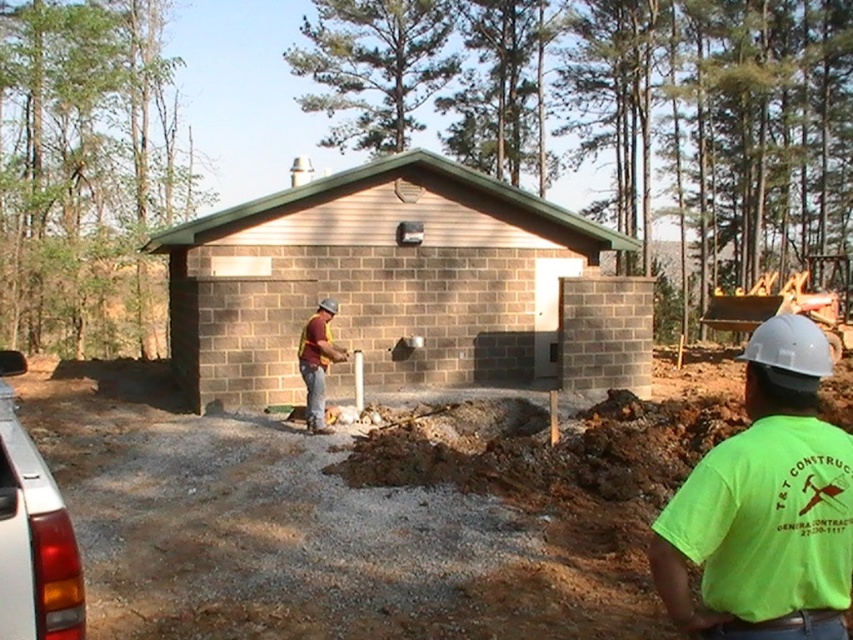
Question: Is brown brick building at center above brown fabric safety vest at center?

Choices:
 (A) yes
 (B) no

Answer: (B)

Question: Which of the following is the farthest from the observer?

Choices:
 (A) neon green t-shirt at center
 (B) brown fabric safety vest at center
 (C) maroon fabric shirt at center

Answer: (B)

Question: Which point is closer to the camera?

Choices:
 (A) (312, 349)
 (B) (343, 211)
 (C) (318, 417)
 (D) (840, 541)

Answer: (D)

Question: Is brown brick building at center positioned before neon green t-shirt at center?

Choices:
 (A) no
 (B) yes

Answer: (A)

Question: Can you confirm if maroon fabric shirt at center is bigger than brown fabric safety vest at center?

Choices:
 (A) no
 (B) yes

Answer: (B)

Question: Which point is farther from the camera taking this photo?

Choices:
 (A) (306, 348)
 (B) (321, 326)

Answer: (A)